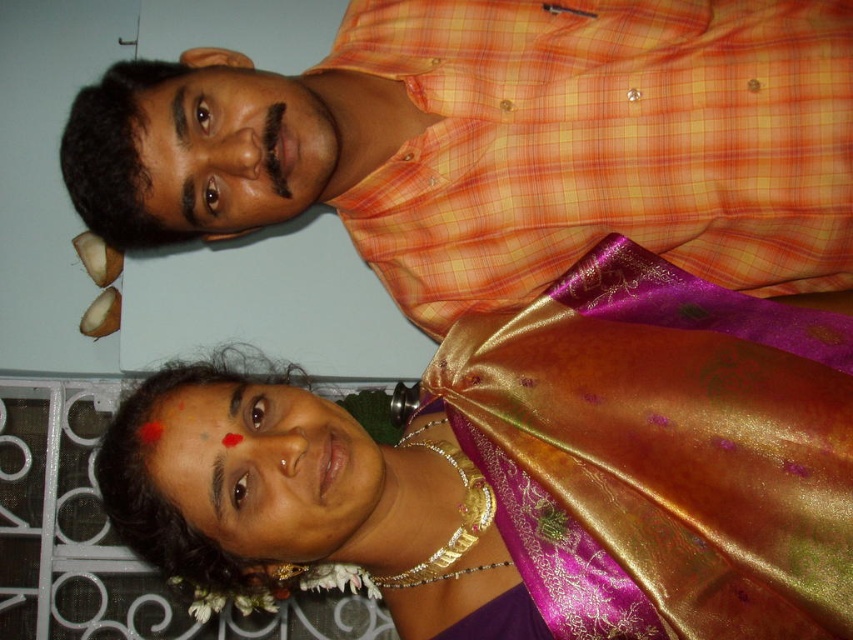
Describe the element at coordinates (531, 468) in the screenshot. I see `shiny silk saree at center` at that location.

Is shiny silk saree at center bigger than orange checkered shirt at upper center?

Indeed, shiny silk saree at center has a larger size compared to orange checkered shirt at upper center.

At what (x,y) coordinates should I click in order to perform the action: click on shiny silk saree at center. Please return your answer as a coordinate pair (x, y). Looking at the image, I should click on (531, 468).

Where is `shiny silk saree at center`? The height and width of the screenshot is (640, 853). shiny silk saree at center is located at coordinates (531, 468).